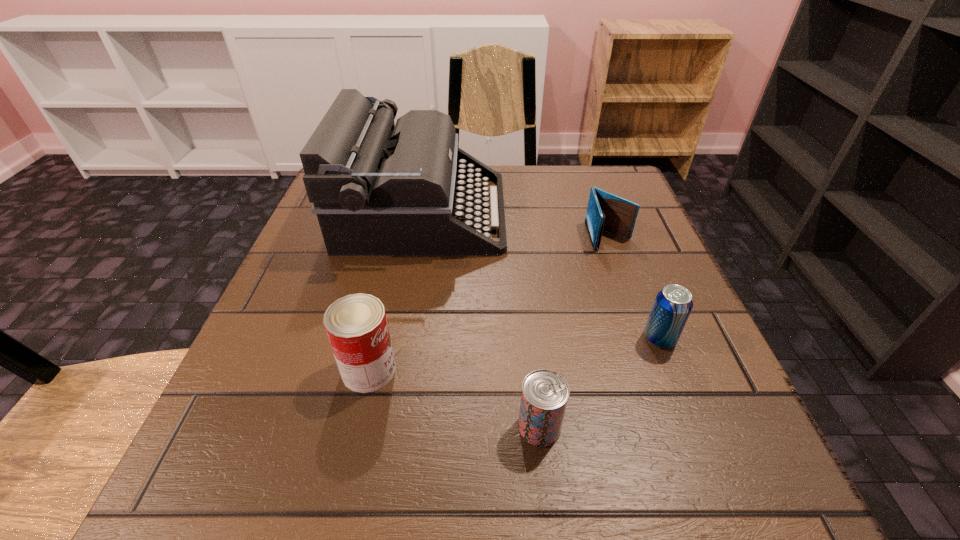
In order to click on empty space that is in between the wallet and the can in this screenshot , I will do `click(489, 303)`.

Locate an element on the screen. The image size is (960, 540). free spot between the right beer can and the wallet is located at coordinates (635, 287).

This screenshot has width=960, height=540. What are the coordinates of `free space between the nearer beer can and the typewriter` in the screenshot? It's located at (481, 320).

Find the location of a particular element. The width and height of the screenshot is (960, 540). free area in between the wallet and the tallest object is located at coordinates (516, 224).

At what (x,y) coordinates should I click in order to perform the action: click on empty space that is in between the wallet and the typewriter. Please return your answer as a coordinate pair (x, y). This screenshot has height=540, width=960. Looking at the image, I should click on (516, 224).

This screenshot has width=960, height=540. Identify the location of object that can be found as the closest to the farther beer can. (545, 393).

Locate which object is the fourth closest to the wallet. Please provide its 2D coordinates. Your answer should be formatted as a tuple, i.e. [(x, y)], where the tuple contains the x and y coordinates of a point satisfying the conditions above.

[(356, 325)]

Find the location of a particular element. vacant area in the image that satisfies the following two spatial constraints: 1. on the typing side of the typewriter; 2. on the left side of the farther beer can is located at coordinates (401, 339).

The height and width of the screenshot is (540, 960). I want to click on vacant space that satisfies the following two spatial constraints: 1. on the front label of the can; 2. on the left side of the nearest object, so click(x=356, y=427).

This screenshot has height=540, width=960. In order to click on free point that satisfies the following two spatial constraints: 1. on the typing side of the farther beer can; 2. on the right side of the typewriter in this screenshot , I will do `click(401, 339)`.